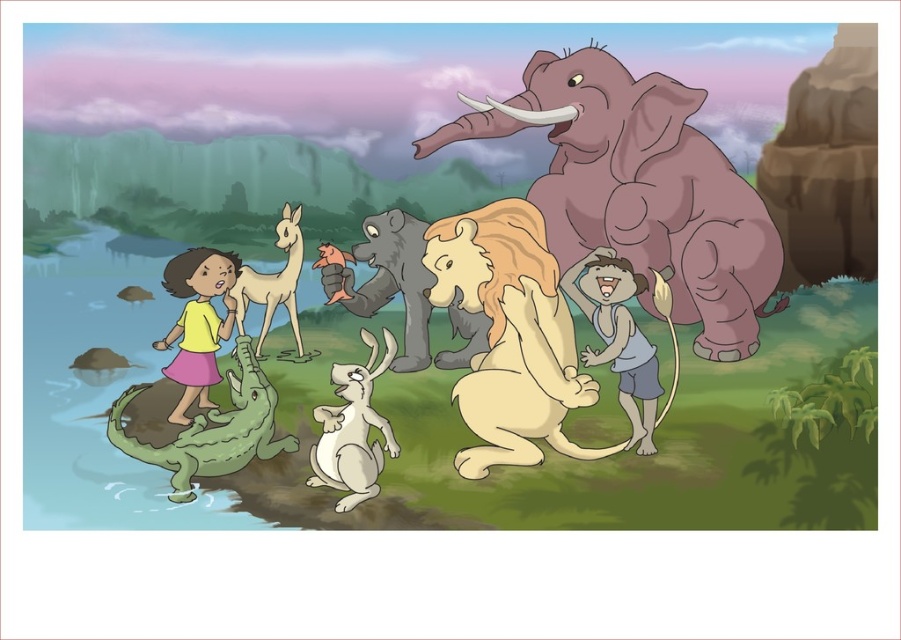
Who is more forward, (530, 221) or (653, 356)?

Point (530, 221) is more forward.

Who is taller, light brown fur lion at center or light brown skin at center?

light brown fur lion at center is taller.

This screenshot has width=901, height=640. What are the coordinates of `light brown fur lion at center` in the screenshot? It's located at (510, 336).

Is point (572, 204) positioned before point (190, 362)?

No, (572, 204) is further to viewer.

Is gray matte elephant at upper right taller than yellow matte shirt at center?

Correct, gray matte elephant at upper right is much taller as yellow matte shirt at center.

Who is more distant from viewer, (623, 77) or (193, 264)?

Positioned behind is point (193, 264).

You are a GUI agent. You are given a task and a screenshot of the screen. Output one action in this format:
    pyautogui.click(x=<x>, y=<y>)
    Task: Click on the gray matte elephant at upper right
    The image size is (901, 640).
    Given the screenshot: What is the action you would take?
    pyautogui.click(x=642, y=189)

Is light brown skin at center below yellow matte shirt at center?

Indeed, light brown skin at center is positioned under yellow matte shirt at center.

Does light brown skin at center have a larger size compared to yellow matte shirt at center?

Indeed, light brown skin at center has a larger size compared to yellow matte shirt at center.

At what (x,y) coordinates should I click in order to perform the action: click on light brown skin at center. Please return your answer as a coordinate pair (x, y). The height and width of the screenshot is (640, 901). Looking at the image, I should click on (617, 337).